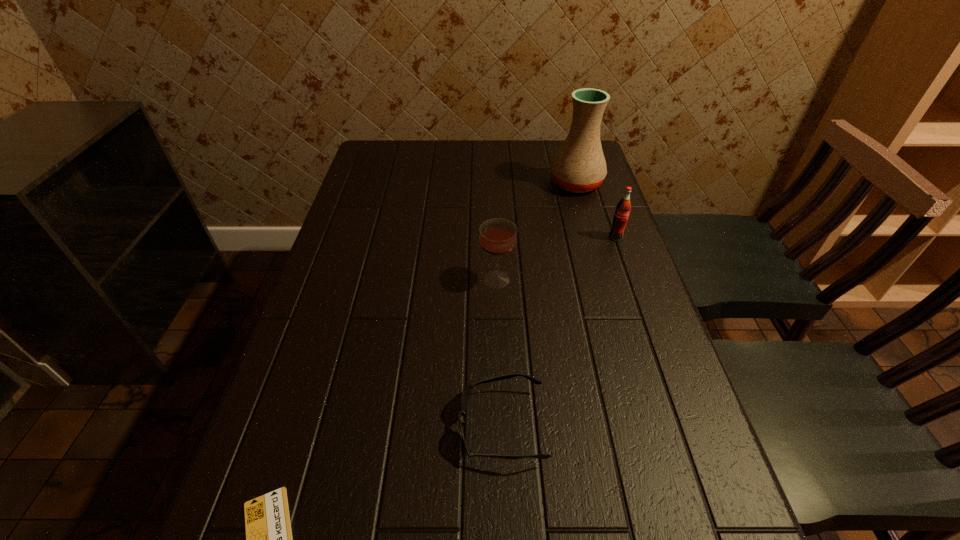
You are a GUI agent. You are given a task and a screenshot of the screen. Output one action in this format:
    pyautogui.click(x=<x>, y=<y>)
    Task: Click on the vacant area that lies between the third farthest object and the sunglasses
    
    Given the screenshot: What is the action you would take?
    pyautogui.click(x=499, y=353)

At what (x,y) coordinates should I click in order to perform the action: click on free space between the third nearest object and the second farthest object. Please return your answer as a coordinate pair (x, y). Looking at the image, I should click on (557, 258).

Identify the location of vacant area that lies between the farthest object and the third nearest object. The image size is (960, 540). (537, 232).

You are a GUI agent. You are given a task and a screenshot of the screen. Output one action in this format:
    pyautogui.click(x=<x>, y=<y>)
    Task: Click on the free space between the soda bottle and the third farthest object
    
    Given the screenshot: What is the action you would take?
    pyautogui.click(x=557, y=258)

Locate an element on the screen. This screenshot has height=540, width=960. unoccupied position between the tallest object and the third farthest object is located at coordinates (537, 232).

Point out which object is positioned as the second nearest to the soda bottle. Please provide its 2D coordinates. Your answer should be formatted as a tuple, i.e. [(x, y)], where the tuple contains the x and y coordinates of a point satisfying the conditions above.

[(498, 237)]

Find the location of a particular element. This screenshot has height=540, width=960. object that is the second closest to the tallest object is located at coordinates point(498,237).

At what (x,y) coordinates should I click in order to perform the action: click on free location that satisfies the following two spatial constraints: 1. on the label of the soda bottle; 2. on the lenses of the sunglasses. Please return your answer as a coordinate pair (x, y). The width and height of the screenshot is (960, 540). Looking at the image, I should click on (683, 426).